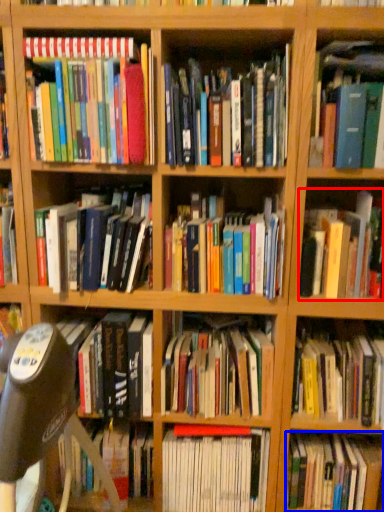
Question: Which of the following is the closest to the observer, book (highlighted by a red box) or book (highlighted by a blue box)?

Choices:
 (A) book
 (B) book

Answer: (A)